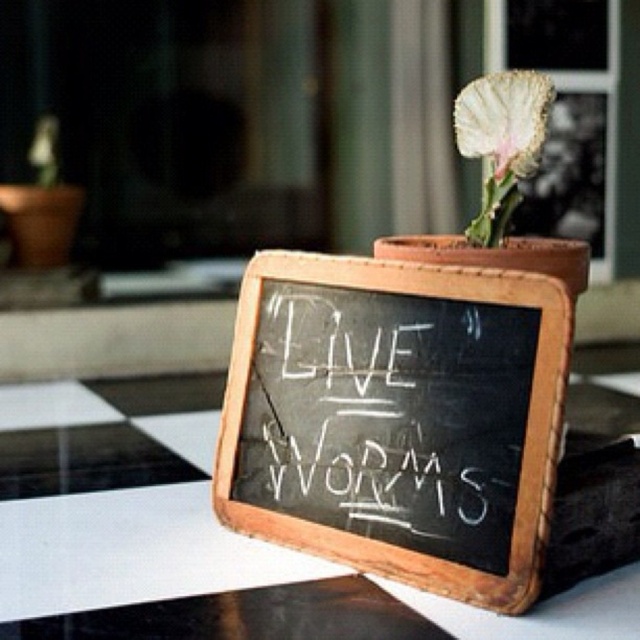
Question: Can you confirm if black chalkboard at center is positioned to the left of white textured leaf at upper center?

Choices:
 (A) no
 (B) yes

Answer: (B)

Question: Which of the following is the farthest from the observer?

Choices:
 (A) (488, 280)
 (B) (310, 586)
 (C) (420, 339)
 (D) (508, 118)

Answer: (D)

Question: Does black chalkboard at center appear over white textured leaf at upper center?

Choices:
 (A) yes
 (B) no

Answer: (B)

Question: Estimate the real-world distances between objects in this image. Which object is farther from the black chalkboard at center?

Choices:
 (A) white chalk writing at center
 (B) black glass table at center
 (C) white textured leaf at upper center

Answer: (C)

Question: Is black chalkboard at center smaller than black glass table at center?

Choices:
 (A) no
 (B) yes

Answer: (B)

Question: Which of the following is the farthest from the observer?

Choices:
 (A) white textured leaf at upper center
 (B) white chalk writing at center
 (C) black chalkboard at center
 (D) black glass table at center

Answer: (A)